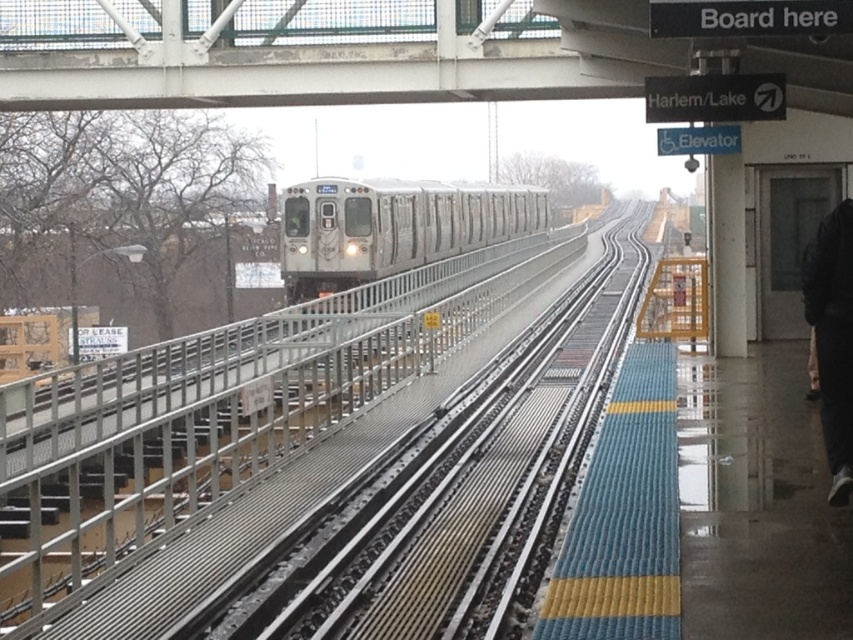
Question: Which of the following is the closest to the observer?

Choices:
 (A) metal/smooth rail at center
 (B) silver metallic train at center

Answer: (A)

Question: Observing the image, what is the correct spatial positioning of metal/smooth rail at center in reference to silver metallic train at center?

Choices:
 (A) above
 (B) below

Answer: (B)

Question: Which point is closer to the camera?

Choices:
 (A) (88, 406)
 (B) (161, 1)
 (C) (421, 225)
 (D) (825, 230)

Answer: (D)

Question: Which of the following is the closest to the observer?

Choices:
 (A) white metal bridge at upper center
 (B) black fabric pants at lower right
 (C) metal/smooth rail at center
 (D) silver metallic train at center

Answer: (C)

Question: Where is white metal bridge at upper center located in relation to silver metallic train at center in the image?

Choices:
 (A) right
 (B) left

Answer: (B)

Question: Does white metal bridge at upper center appear on the left side of silver metallic train at center?

Choices:
 (A) no
 (B) yes

Answer: (B)